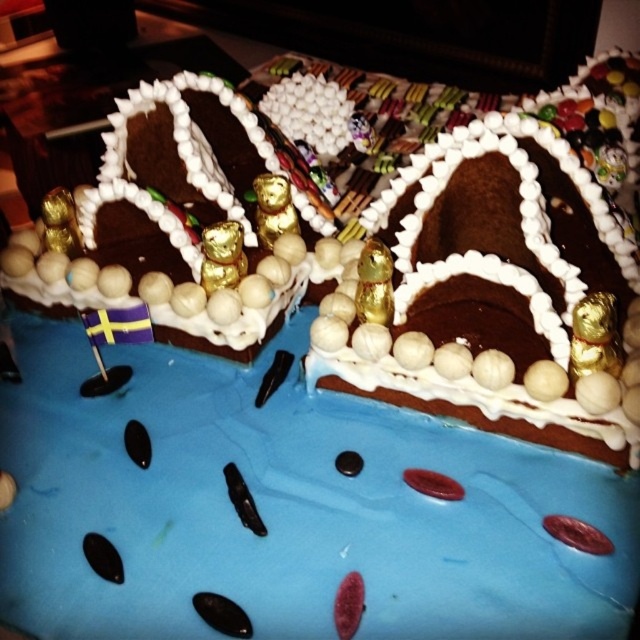
You are standing in front of the gingerbread house and want to place a candy cane. There are two points marked on the image, point (625,413) and point (228,205). Which point is closer to you?

Point (625,413) is closer to the camera than point (228,205), so the candy cane should be placed at point (625,413) to be closer to you.

You are a child who wants to reach the chocolate matte cake at center. You are standing 23.09 inches away from it. Can you grab it without moving your feet?

The chocolate matte cake at center is 23.09 inches away from the viewer, so if the child can reach 23.09 inches without moving their feet, they can grab it. However, typical arm reach may not extend that far, so it might be difficult without moving closer.

You are planning to place a small gift box on the table where the chocolate matte cake at center and chocolate matte gingerbread house at left are placed. Based on their sizes, which object should you move to make space for the gift box?

Since the chocolate matte cake at center occupies less space than the chocolate matte gingerbread house at left, you should move the chocolate matte gingerbread house at left to make more space for the gift box.